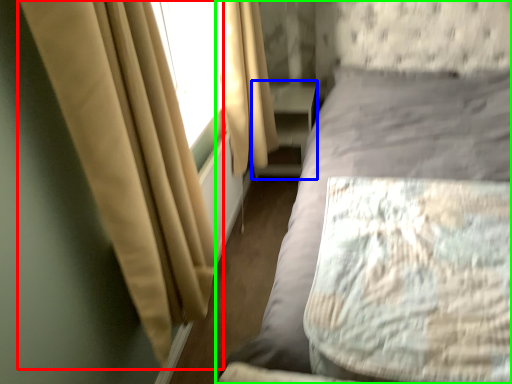
Question: Based on their relative distances, which object is nearer to curtain (highlighted by a red box)? Choose from dresser (highlighted by a blue box) and bed (highlighted by a green box).

Choices:
 (A) dresser
 (B) bed

Answer: (B)